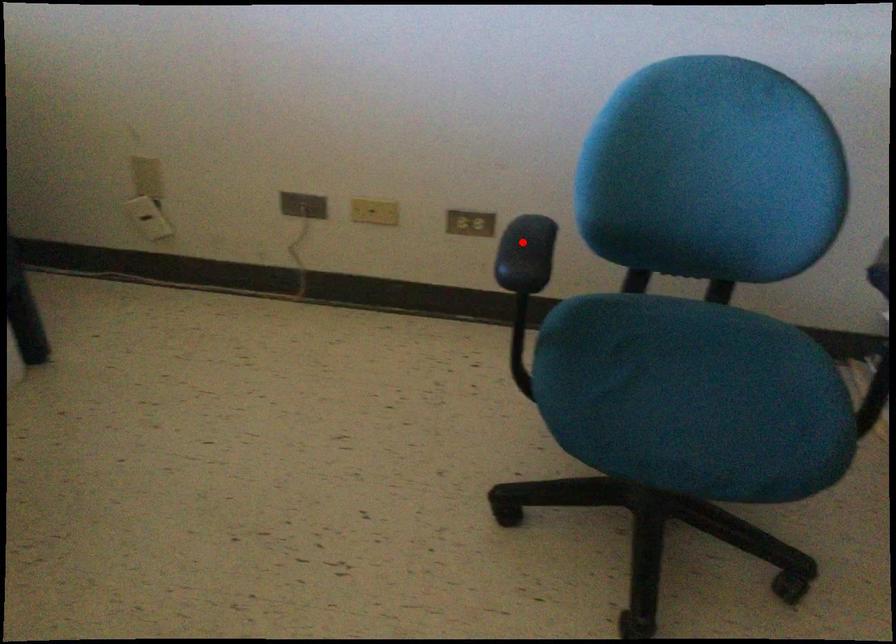
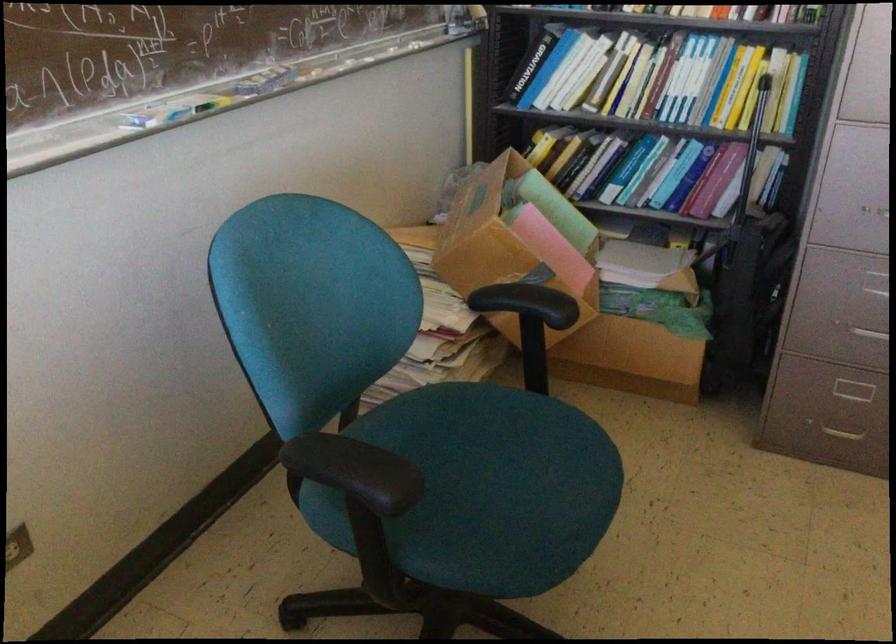
Question: I am providing you with two images of the same scene from different viewpoints. A red point is marked on the first image. At the location where the point appears in image 1, is it still visible in image 2?

Choices:
 (A) Yes
 (B) No

Answer: (A)